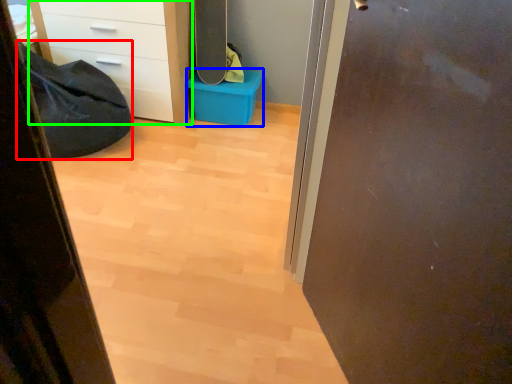
Question: Considering the real-world distances, which object is closest to sleeping bag (highlighted by a red box)? storage box (highlighted by a blue box) or chest of drawers (highlighted by a green box).

Choices:
 (A) storage box
 (B) chest of drawers

Answer: (B)